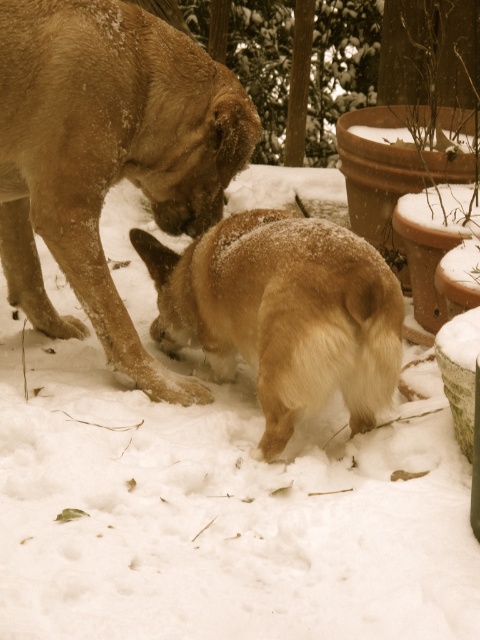
Question: Can you confirm if fuzzy fur dog at center is positioned below fuzzy brown dog at lower center?

Choices:
 (A) yes
 (B) no

Answer: (B)

Question: Where is fuzzy fur dog at center located in relation to fuzzy brown dog at lower center in the image?

Choices:
 (A) above
 (B) below

Answer: (A)

Question: Can you confirm if fuzzy fur dog at center is smaller than fuzzy brown dog at lower center?

Choices:
 (A) yes
 (B) no

Answer: (B)

Question: Which object is farther from the camera taking this photo?

Choices:
 (A) fuzzy fur dog at center
 (B) fuzzy brown dog at lower center

Answer: (A)